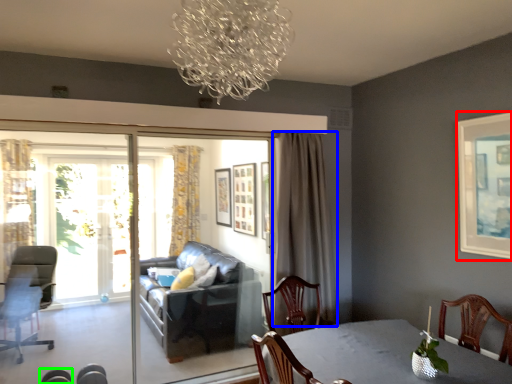
Question: Which is farther away from picture frame (highlighted by a red box)? curtain (highlighted by a blue box) or chair (highlighted by a green box)?

Choices:
 (A) curtain
 (B) chair

Answer: (B)